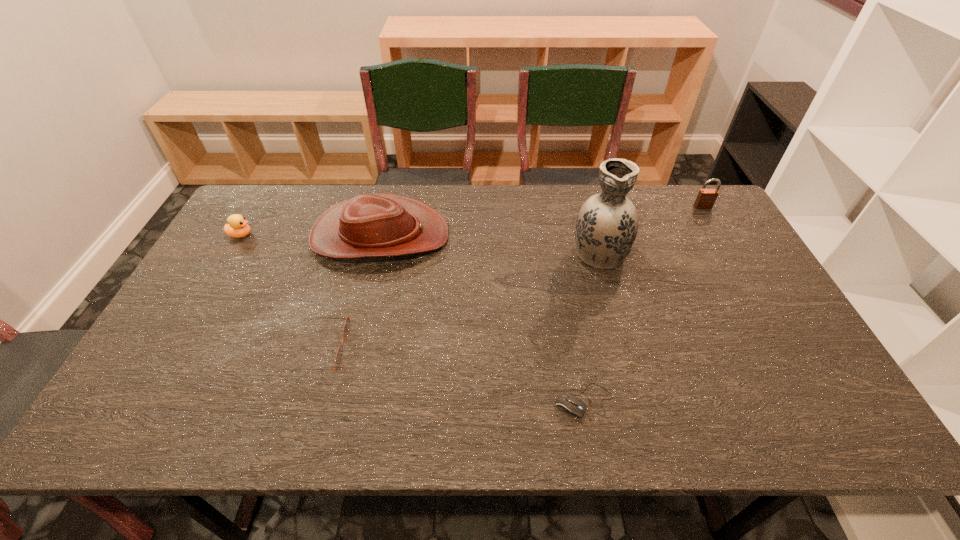
Image resolution: width=960 pixels, height=540 pixels. Identify the location of free point between the computer mouse and the sunglasses. (453, 375).

Identify the location of free space between the sunglasses and the rightmost object. (513, 278).

Identify the location of free space between the second shortest object and the nearest object. The height and width of the screenshot is (540, 960). (453, 375).

At what (x,y) coordinates should I click in order to perform the action: click on free spot between the cowboy hat and the nearest object. Please return your answer as a coordinate pair (x, y). Looking at the image, I should click on (482, 319).

Where is `vacant space that is in between the rightmost object and the duckling`? This screenshot has height=540, width=960. vacant space that is in between the rightmost object and the duckling is located at coordinates (471, 221).

The width and height of the screenshot is (960, 540). In order to click on vacant space that is in between the cowboy hat and the vase in this screenshot , I will do `click(490, 244)`.

Identify the location of vacant area that lies between the cowboy hat and the nearest object. The height and width of the screenshot is (540, 960). (482, 319).

The width and height of the screenshot is (960, 540). What are the coordinates of `empty space between the vase and the sunglasses` in the screenshot? It's located at (461, 300).

Point out which object is positioned as the second nearest to the padlock. Please provide its 2D coordinates. Your answer should be formatted as a tuple, i.e. [(x, y)], where the tuple contains the x and y coordinates of a point satisfying the conditions above.

[(570, 405)]

Image resolution: width=960 pixels, height=540 pixels. I want to click on the closest object to the cowboy hat, so click(x=237, y=227).